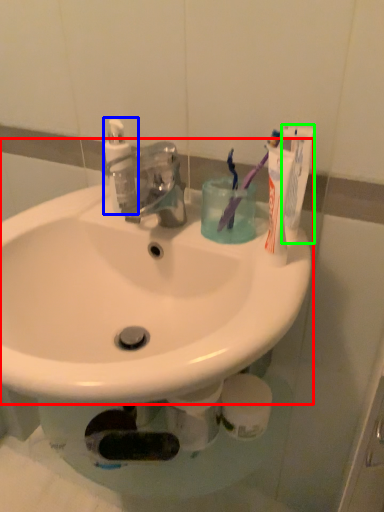
Question: Estimate the real-world distances between objects in this image. Which object is farther from sink (highlighted by a red box), soap dispenser (highlighted by a blue box) or toothpaste (highlighted by a green box)?

Choices:
 (A) soap dispenser
 (B) toothpaste

Answer: (B)